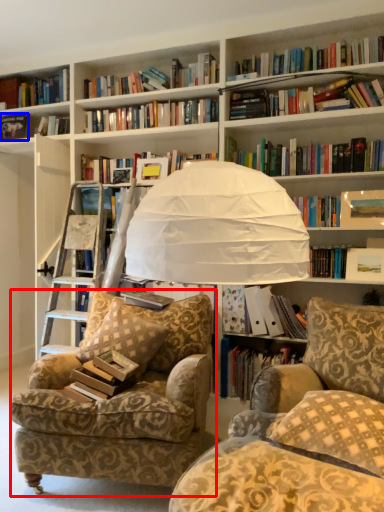
Question: Which of the following is the farthest to the observer, chair (highlighted by a red box) or book (highlighted by a blue box)?

Choices:
 (A) chair
 (B) book

Answer: (B)